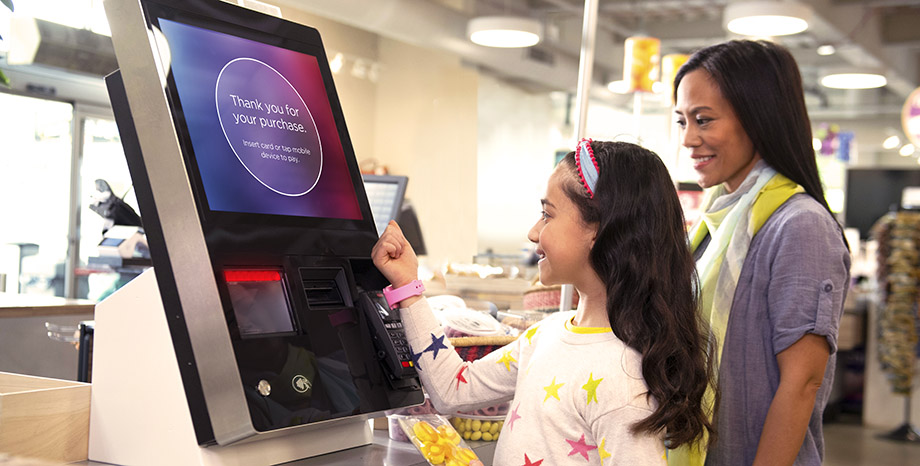
Find the location of a particular element. The image size is (920, 466). large screen is located at coordinates (198, 53).